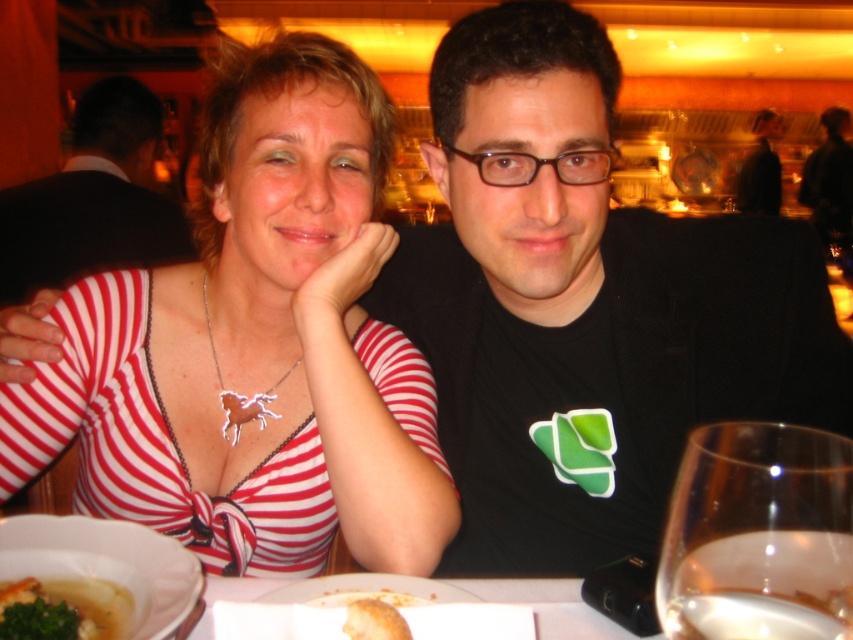
Question: Among these objects, which one is farthest from the camera?

Choices:
 (A) matte red and white striped dress at center
 (B) white creamy soup at lower left
 (C) brown plastic glasses at center
 (D) black matte shirt at center

Answer: (C)

Question: Does brown plastic glasses at center have a greater width compared to black matte suit at upper right?

Choices:
 (A) yes
 (B) no

Answer: (B)

Question: Can you confirm if black matte shirt at center is positioned above matte red and white striped dress at center?

Choices:
 (A) yes
 (B) no

Answer: (B)

Question: Which point is closer to the camera?

Choices:
 (A) (105, 577)
 (B) (125, 589)
 (C) (364, 604)
 (D) (90, 118)

Answer: (C)

Question: Does white creamy soup at lower left appear under black matte suit at upper right?

Choices:
 (A) yes
 (B) no

Answer: (A)

Question: Which object is closer to the camera taking this photo?

Choices:
 (A) brown plastic glasses at center
 (B) black matte shirt at center
 (C) white creamy soup at lower left

Answer: (C)